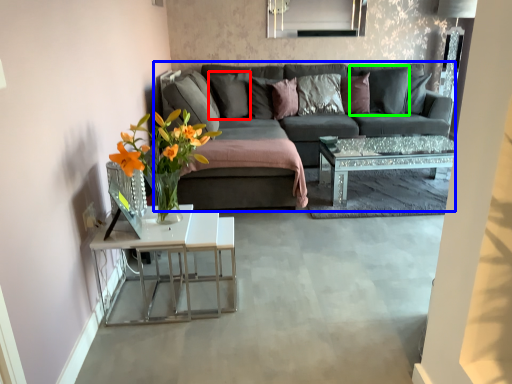
Question: Based on their relative distances, which object is nearer to pillow (highlighted by a red box)? Choose from studio couch (highlighted by a blue box) and pillow (highlighted by a green box).

Choices:
 (A) studio couch
 (B) pillow

Answer: (A)